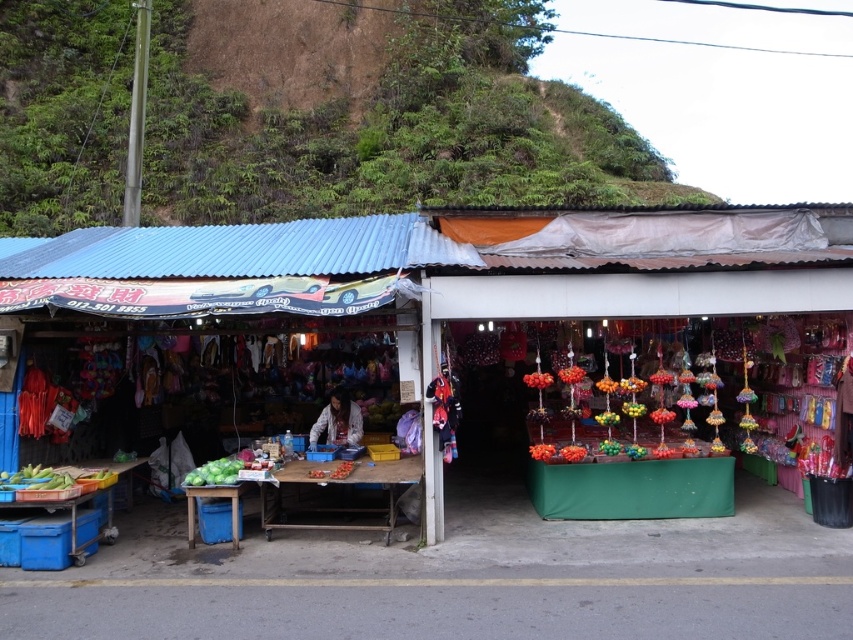
You are a customer at the market stall and want to buy the green matte cabbage at lower left. You need to know if the cabbage is taller than the green grassy hillside at upper left. Can you tell me?

The green grassy hillside at upper left is taller than the green matte cabbage at lower left, so the cabbage is not taller than the hillside.

You are setting up a small market stall and want to place a green matte cabbage at lower left next to the matte plastic stall at center. Considering their sizes, will the cabbage fit comfortably next to the stall without overcrowding the space?

The matte plastic stall at center is wider than the green matte cabbage at lower left, so placing the cabbage next to the stall should be possible without overcrowding the space.